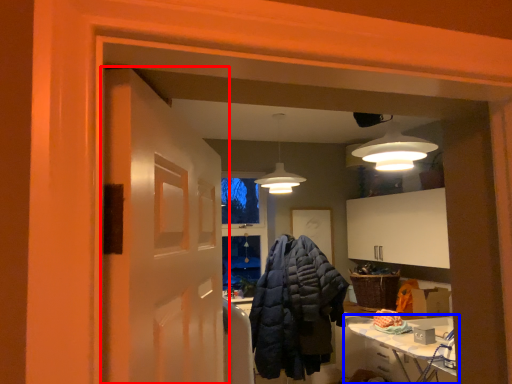
Question: Among these objects, which one is farthest to the camera, door (highlighted by a red box) or table (highlighted by a blue box)?

Choices:
 (A) door
 (B) table

Answer: (B)